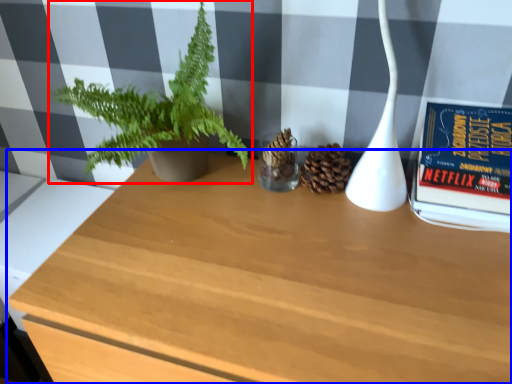
Question: Which object appears farthest to the camera in this image, houseplant (highlighted by a red box) or table (highlighted by a blue box)?

Choices:
 (A) houseplant
 (B) table

Answer: (A)